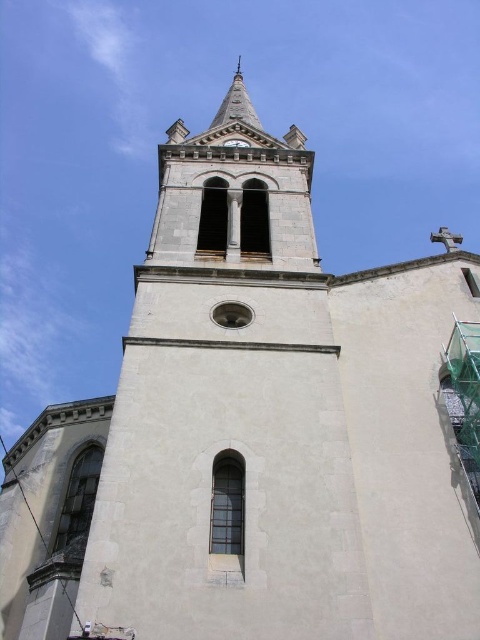
Question: Is white stone spire at upper center to the right of dark brown wooden clock at center from the viewer's perspective?

Choices:
 (A) no
 (B) yes

Answer: (A)

Question: Can you confirm if white stone spire at upper center is thinner than dark brown wooden clock at center?

Choices:
 (A) yes
 (B) no

Answer: (B)

Question: Is white stone spire at upper center to the right of dark brown wooden clock at center from the viewer's perspective?

Choices:
 (A) yes
 (B) no

Answer: (B)

Question: Which object is farther from the camera taking this photo?

Choices:
 (A) white stone spire at upper center
 (B) dark brown wooden clock at center

Answer: (A)

Question: Among these objects, which one is farthest from the camera?

Choices:
 (A) dark brown wooden clock at center
 (B) white stone spire at upper center

Answer: (B)